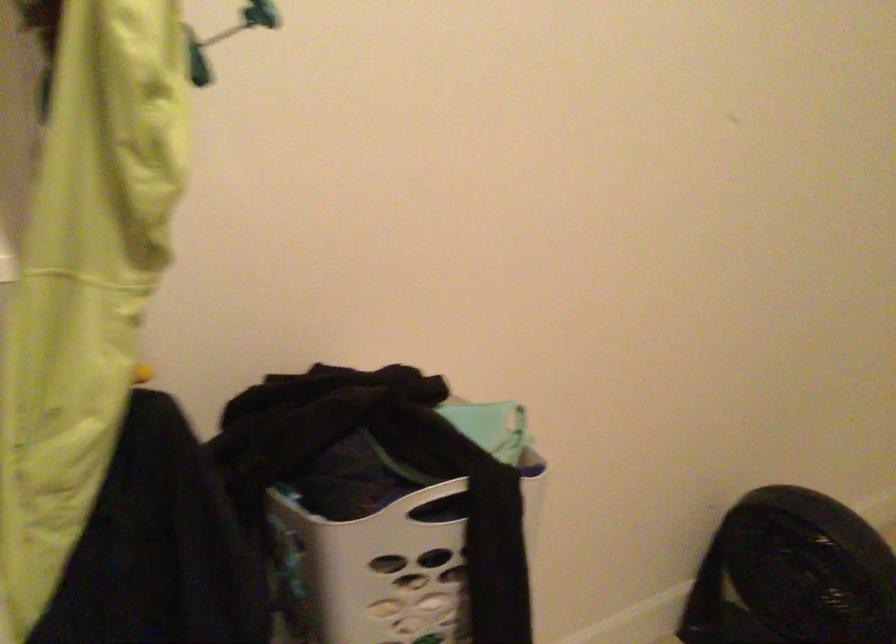
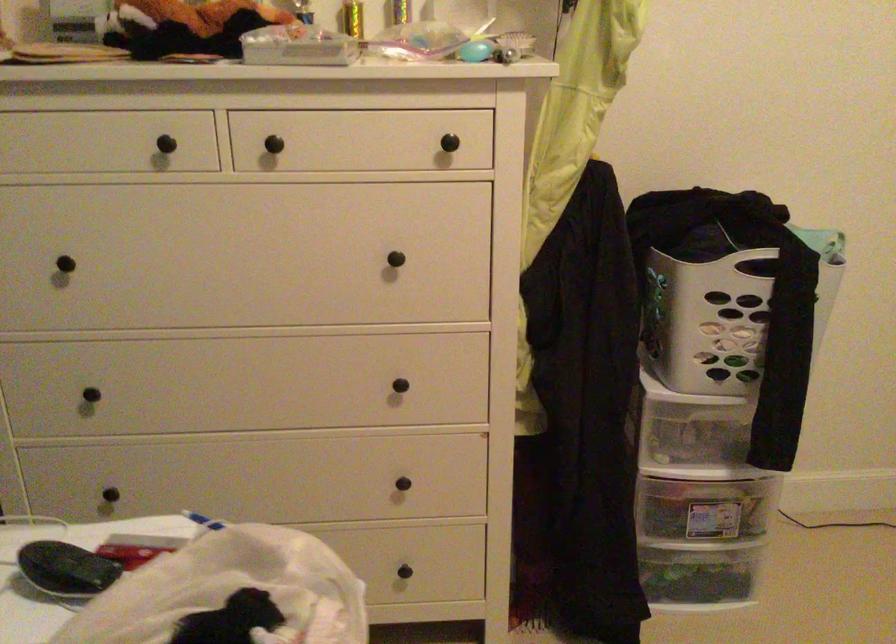
Find the pixel in the second image that matches [522,502] in the first image.

(829, 277)